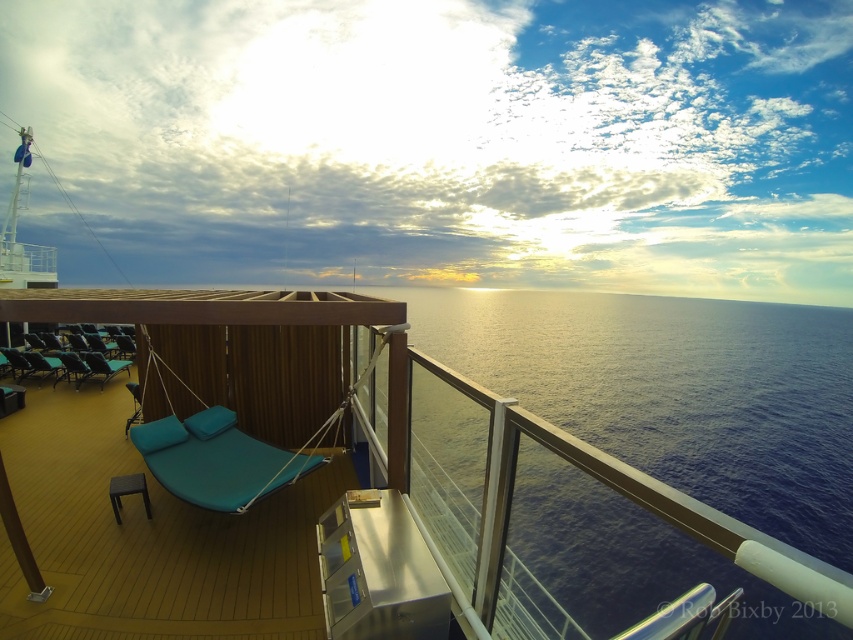
You are planning to place a large potted plant between the teal fabric daybed at center and the teal fabric lounge chair at center. Based on their widths, which object should the plant be closer to?

The teal fabric daybed at center is wider than the teal fabric lounge chair at center, so the plant should be placed closer to the teal fabric daybed at center to maintain balance.

You are standing on the deck and want to take a photo of the blue water at center. You have a camera that can only focus on objects within 10 meters. The teal fabric lounge chair at center is 8 meters away from you. Can you take the photo without moving?

The blue water at center is in front of the teal fabric lounge chair at center. Since the teal fabric lounge chair at center is 8 meters away, the blue water at center is closer than 8 meters. Therefore, the camera can focus on the blue water at center within the 10 meters range, so yes, you can take the photo without moving.